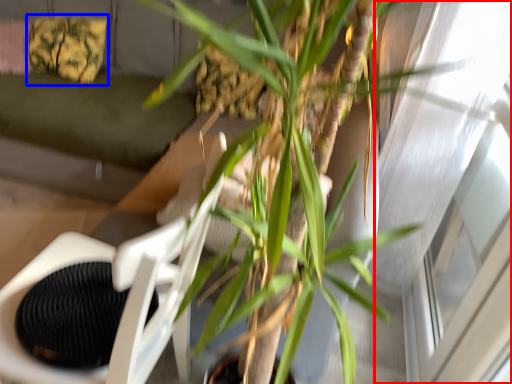
Question: Which object appears farthest to the camera in this image, window (highlighted by a red box) or pillow (highlighted by a blue box)?

Choices:
 (A) window
 (B) pillow

Answer: (B)